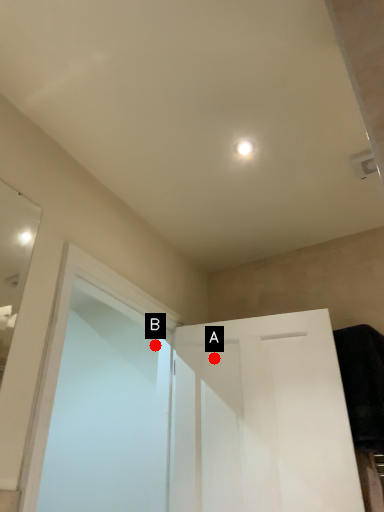
Question: Two points are circled on the image, labeled by A and B beside each circle. Which of the following is the closest to the observer?

Choices:
 (A) A is closer
 (B) B is closer

Answer: (A)